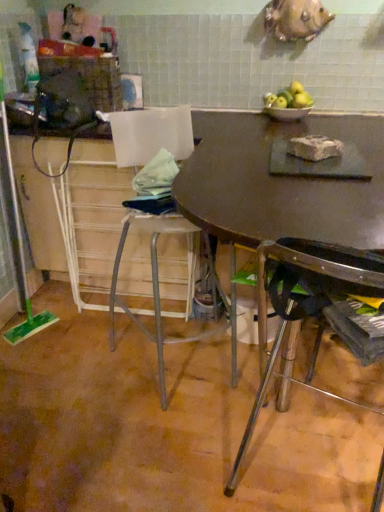
You are a GUI agent. You are given a task and a screenshot of the screen. Output one action in this format:
    pyautogui.click(x=<x>, y=<y>)
    Task: Click on the free space in front of metallic silver stool at center, which ranks as the second chair in right-to-left order
    Image resolution: width=384 pixels, height=512 pixels.
    Given the screenshot: What is the action you would take?
    pyautogui.click(x=113, y=454)